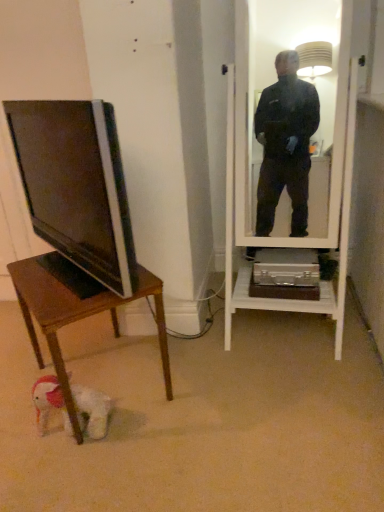
Question: Is white plush dog at lower left completely or partially outside of matte black tv at left?

Choices:
 (A) yes
 (B) no

Answer: (A)

Question: From a real-world perspective, is white plush dog at lower left located beneath matte black tv at left?

Choices:
 (A) no
 (B) yes

Answer: (B)

Question: From a real-world perspective, is white plush dog at lower left on matte black tv at left?

Choices:
 (A) yes
 (B) no

Answer: (B)

Question: Considering the relative positions of white plush dog at lower left and matte black tv at left in the image provided, is white plush dog at lower left to the left of matte black tv at left from the viewer's perspective?

Choices:
 (A) yes
 (B) no

Answer: (B)

Question: Does white plush dog at lower left have a lesser width compared to matte black tv at left?

Choices:
 (A) yes
 (B) no

Answer: (B)

Question: In the image, is wooden desk at lower left on the left side or the right side of white plush dog at lower left?

Choices:
 (A) right
 (B) left

Answer: (A)

Question: From the image's perspective, is wooden desk at lower left above or below white plush dog at lower left?

Choices:
 (A) below
 (B) above

Answer: (B)

Question: From their relative heights in the image, would you say wooden desk at lower left is taller or shorter than white plush dog at lower left?

Choices:
 (A) tall
 (B) short

Answer: (A)

Question: Which is correct: wooden desk at lower left is inside white plush dog at lower left, or outside of it?

Choices:
 (A) outside
 (B) inside

Answer: (A)

Question: From a real-world perspective, is wooden desk at lower left physically located above or below matte black tv at left?

Choices:
 (A) above
 (B) below

Answer: (B)

Question: Is wooden desk at lower left situated inside matte black tv at left or outside?

Choices:
 (A) inside
 (B) outside

Answer: (B)

Question: Based on their positions, is wooden desk at lower left located to the left or right of matte black tv at left?

Choices:
 (A) left
 (B) right

Answer: (B)

Question: Is point (59, 302) positioned closer to the camera than point (71, 135)?

Choices:
 (A) closer
 (B) farther

Answer: (B)

Question: In terms of size, does matte black tv at left appear bigger or smaller than wooden desk at lower left?

Choices:
 (A) big
 (B) small

Answer: (B)

Question: Considering the positions of point (79, 136) and point (158, 302), is point (79, 136) closer or farther from the camera than point (158, 302)?

Choices:
 (A) closer
 (B) farther

Answer: (A)